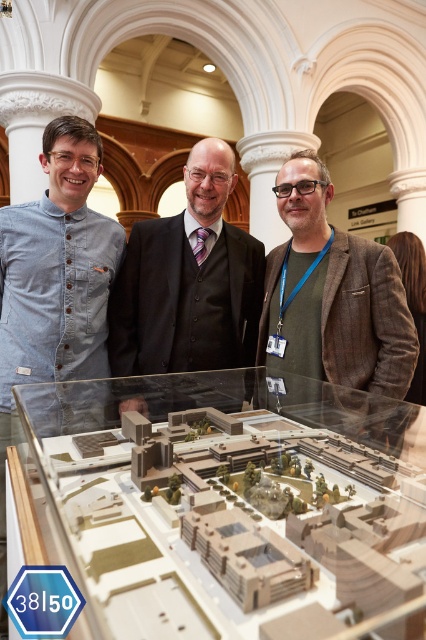
Question: Is brown tweed blazer at center wider than brown textured suit at center?

Choices:
 (A) no
 (B) yes

Answer: (A)

Question: Does brown tweed blazer at center have a greater width compared to brown textured suit at center?

Choices:
 (A) no
 (B) yes

Answer: (A)

Question: Which of the following is the closest to the observer?

Choices:
 (A) (241, 348)
 (B) (414, 355)

Answer: (B)

Question: Which point appears closest to the camera in this image?

Choices:
 (A) (161, 349)
 (B) (299, 348)

Answer: (B)

Question: Is brown tweed blazer at center to the left of brown textured suit at center from the viewer's perspective?

Choices:
 (A) no
 (B) yes

Answer: (A)

Question: Among these points, which one is nearest to the camera?

Choices:
 (A) [195, 356]
 (B) [321, 352]

Answer: (B)